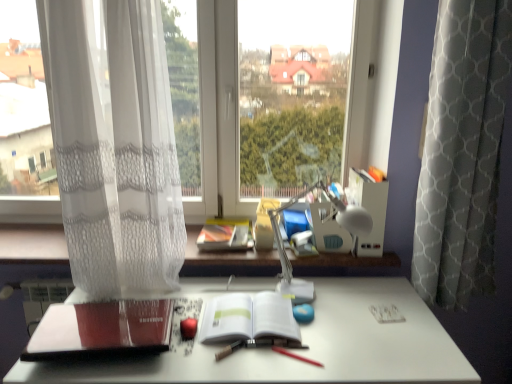
Find the location of a particular element. Image resolution: width=512 pixels, height=384 pixels. vacant space that is in between white plastic table lamp at center and smooth red crayon at center is located at coordinates (331, 336).